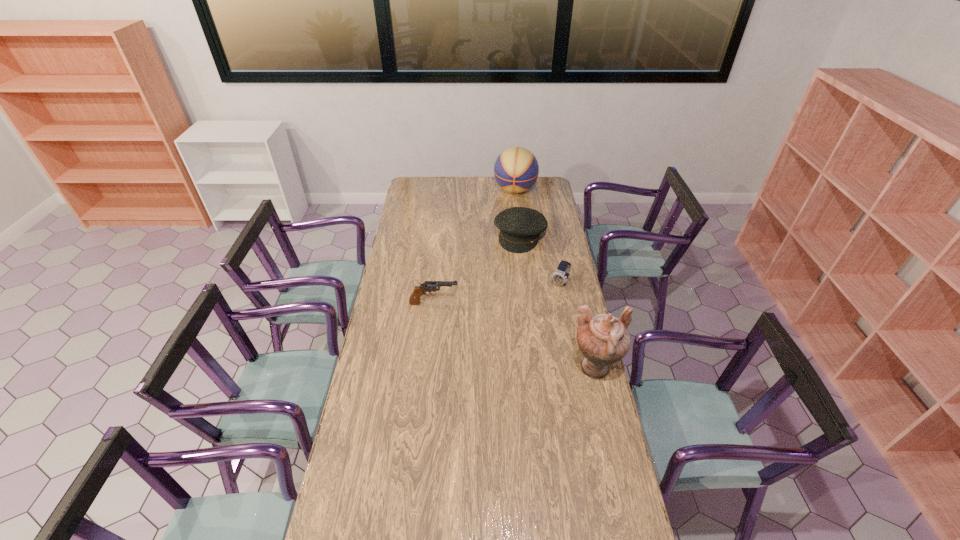
Identify the location of vacant point located between the basketball and the second nearest object. (474, 247).

Where is `unoccupied area between the third farthest object and the beret`? The image size is (960, 540). unoccupied area between the third farthest object and the beret is located at coordinates (540, 260).

Locate an element on the screen. free space that is in between the watch and the beret is located at coordinates point(540,260).

The width and height of the screenshot is (960, 540). Identify the location of blank region between the beret and the leftmost object. (477, 270).

Identify the location of vacant space that's between the farthest object and the fourth farthest object. (474, 247).

Locate an element on the screen. The width and height of the screenshot is (960, 540). object that is the third closest to the urn is located at coordinates [x=520, y=227].

I want to click on object that stands as the closest to the urn, so click(x=560, y=277).